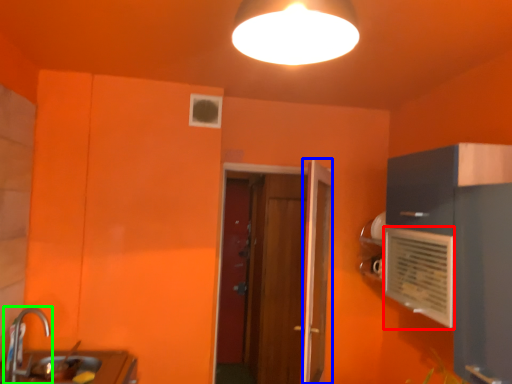
Question: Estimate the real-world distances between objects in this image. Which object is closer to air conditioning (highlighted by a red box), door (highlighted by a blue box) or tap (highlighted by a green box)?

Choices:
 (A) door
 (B) tap

Answer: (A)